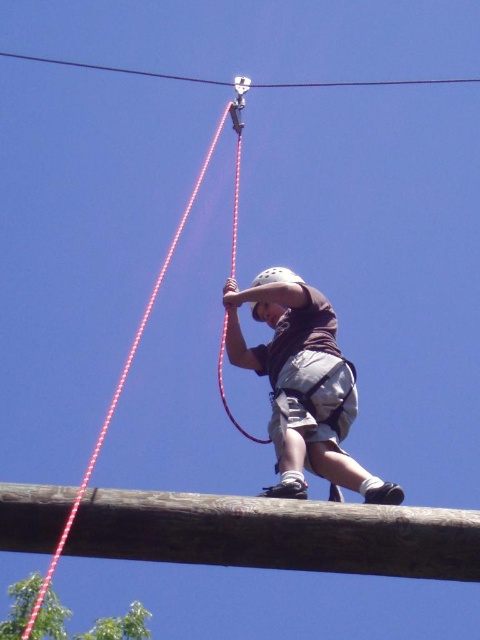
This screenshot has width=480, height=640. I want to click on metallic wire at upper center, so click(x=112, y=68).

Is metallic wire at upper center further to camera compared to red rope at center?

Yes, it is.

Between point (316, 83) and point (238, 148), which one is positioned behind?

Positioned behind is point (316, 83).

What are the coordinates of `metallic wire at upper center` in the screenshot? It's located at (112, 68).

Who is shorter, brown rough wood beam at center or matte brown shirt at center?

Standing shorter between the two is brown rough wood beam at center.

Can you confirm if brown rough wood beam at center is positioned above matte brown shirt at center?

Actually, brown rough wood beam at center is below matte brown shirt at center.

Where is `brown rough wood beam at center`? This screenshot has width=480, height=640. brown rough wood beam at center is located at coordinates [x=276, y=534].

Can you confirm if matte brown shirt at center is thinner than metallic wire at upper center?

Indeed, matte brown shirt at center has a lesser width compared to metallic wire at upper center.

You are a GUI agent. You are given a task and a screenshot of the screen. Output one action in this format:
    pyautogui.click(x=<x>, y=<y>)
    Task: Click on the matte brown shirt at center
    
    Given the screenshot: What is the action you would take?
    pyautogui.click(x=302, y=385)